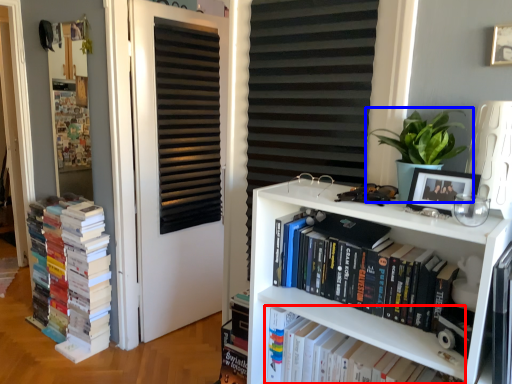
Question: Which of the following is the farthest to the observer, book (highlighted by a red box) or houseplant (highlighted by a blue box)?

Choices:
 (A) book
 (B) houseplant

Answer: (A)